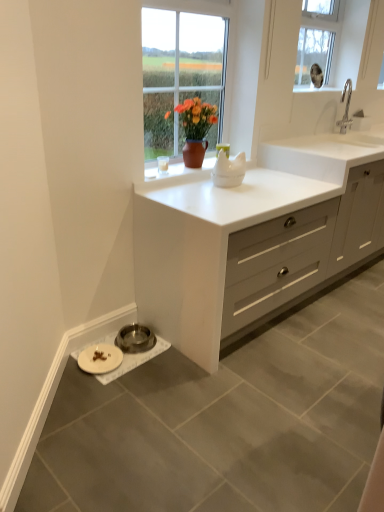
Question: Is clear glass window at upper center shorter than white matte plate at lower left?

Choices:
 (A) no
 (B) yes

Answer: (A)

Question: Does clear glass window at upper center lie behind white matte plate at lower left?

Choices:
 (A) no
 (B) yes

Answer: (B)

Question: Does clear glass window at upper center appear on the left side of white matte plate at lower left?

Choices:
 (A) no
 (B) yes

Answer: (A)

Question: Is white matte plate at lower left a part of clear glass window at upper center?

Choices:
 (A) yes
 (B) no

Answer: (B)

Question: Would you say clear glass window at upper center is a long distance from white matte plate at lower left?

Choices:
 (A) yes
 (B) no

Answer: (A)

Question: Is clear glass window at upper center wider than white matte plate at lower left?

Choices:
 (A) no
 (B) yes

Answer: (A)

Question: Could you tell me if clear glass window at upper center is turned towards white matte cabinet at center?

Choices:
 (A) yes
 (B) no

Answer: (B)

Question: Is white matte cabinet at center surrounded by clear glass window at upper center?

Choices:
 (A) no
 (B) yes

Answer: (A)

Question: Does clear glass window at upper center have a lesser width compared to white matte cabinet at center?

Choices:
 (A) no
 (B) yes

Answer: (B)

Question: Can we say clear glass window at upper center lies outside white matte cabinet at center?

Choices:
 (A) yes
 (B) no

Answer: (A)

Question: Does clear glass window at upper center come in front of white matte cabinet at center?

Choices:
 (A) yes
 (B) no

Answer: (B)

Question: Is clear glass window at upper center to the left of white matte cabinet at center from the viewer's perspective?

Choices:
 (A) yes
 (B) no

Answer: (B)

Question: From the image's perspective, is white matte cabinet at center located beneath white ceramic sink at upper right?

Choices:
 (A) yes
 (B) no

Answer: (A)